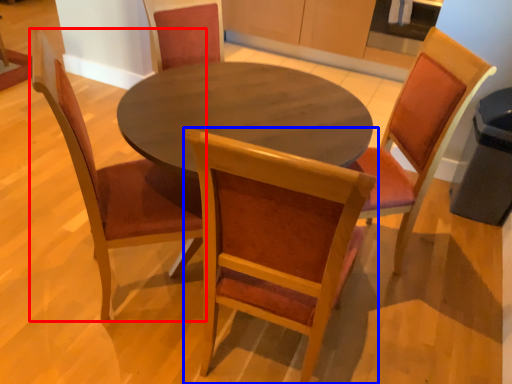
Question: Which object appears closest to the camera in this image, chair (highlighted by a red box) or chair (highlighted by a blue box)?

Choices:
 (A) chair
 (B) chair

Answer: (B)